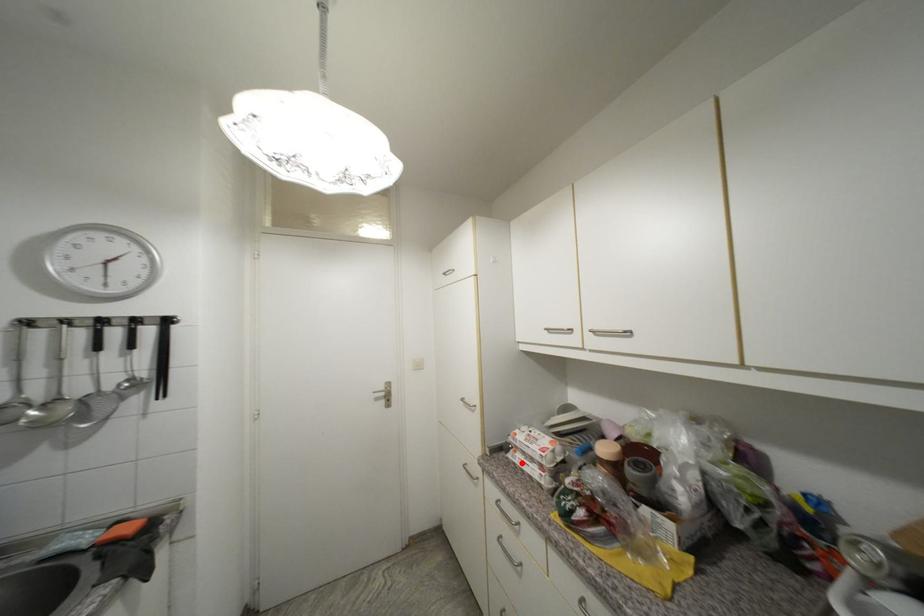
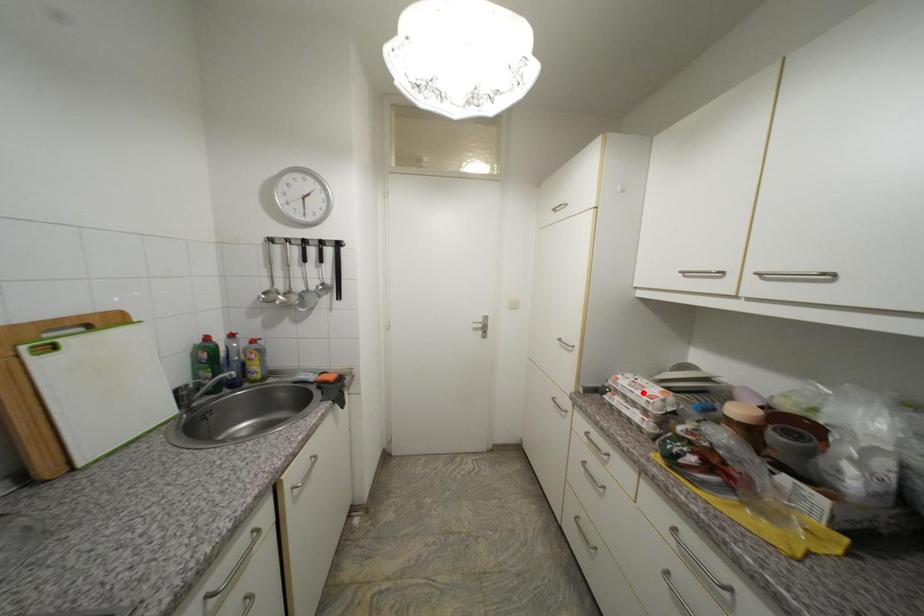
I am providing you with two images of the same scene from different viewpoints. A red point is marked on the first image and another point is marked on the second image. Is the red point in image1 aligned with the point shown in image2?

No